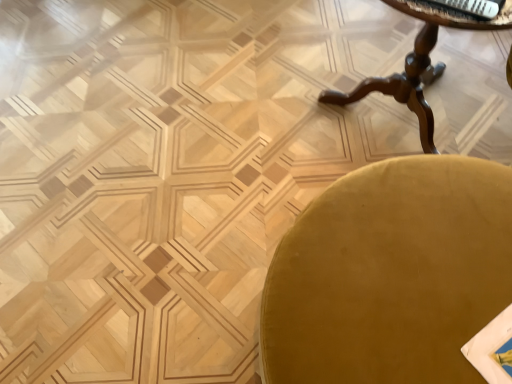
Question: Looking at the image, does white glossy magazine at upper right seem bigger or smaller compared to mahogany wood table at upper right?

Choices:
 (A) small
 (B) big

Answer: (A)

Question: Relative to mahogany wood table at upper right, is white glossy magazine at upper right in front or behind?

Choices:
 (A) front
 (B) behind

Answer: (B)

Question: Which of these objects is positioned farthest from the white glossy magazine at upper right?

Choices:
 (A) mahogany wood table at upper right
 (B) velvet gold chair at lower right

Answer: (B)

Question: Considering the real-world distances, which object is closest to the white glossy magazine at upper right?

Choices:
 (A) mahogany wood table at upper right
 (B) velvet gold chair at lower right

Answer: (A)